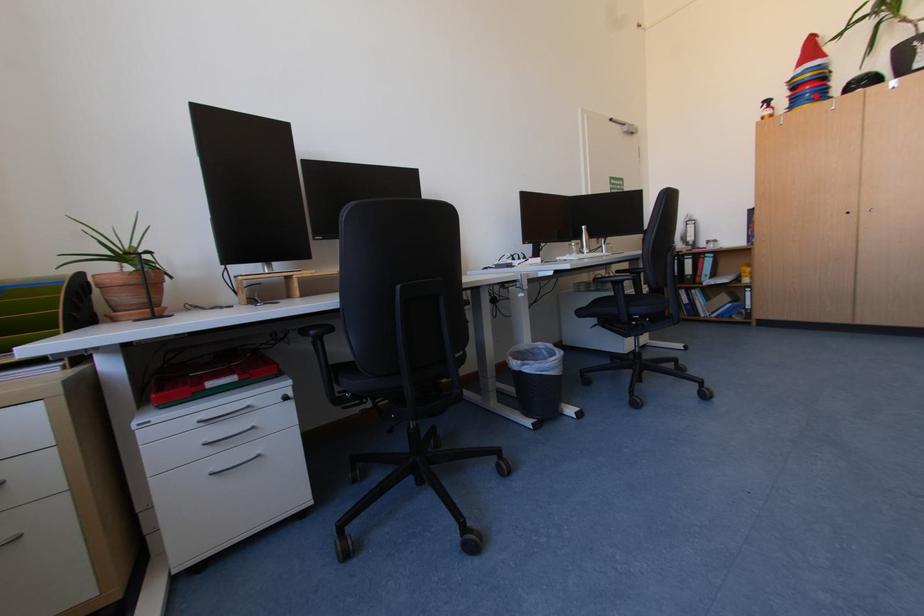
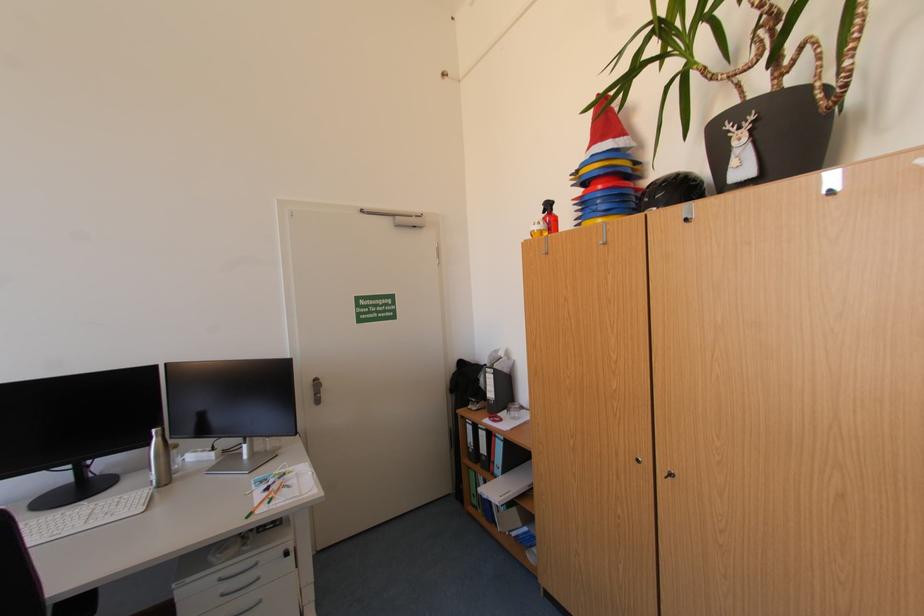
In the second image, find the point that corresponds to the highlighted location in the first image.

(606, 203)